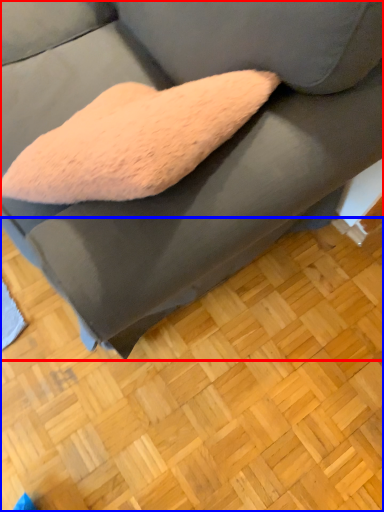
Question: Which object appears farthest to the camera in this image, studio couch (highlighted by a red box) or hardwood (highlighted by a blue box)?

Choices:
 (A) studio couch
 (B) hardwood

Answer: (B)